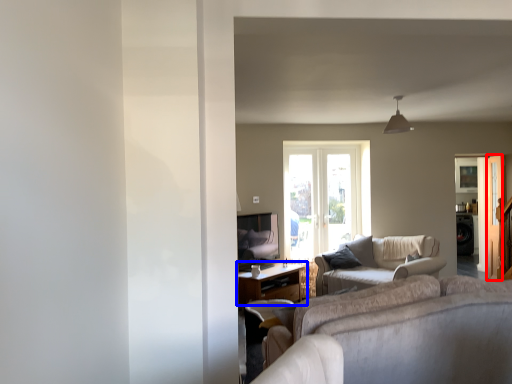
Question: Which of the following is the closest to the observer, screen door (highlighted by a red box) or table (highlighted by a blue box)?

Choices:
 (A) screen door
 (B) table

Answer: (B)